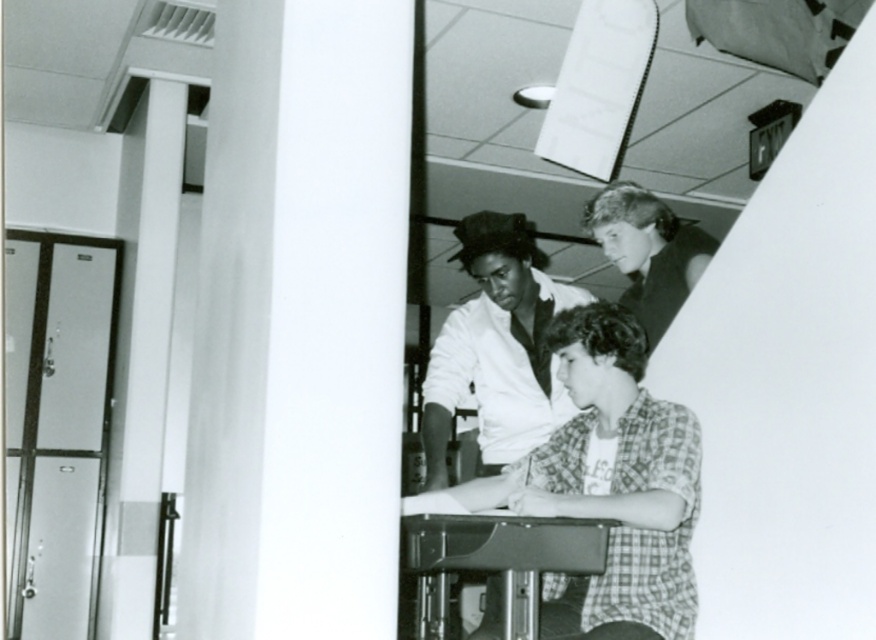
Is smooth white shirt at center wider than metallic gray table at center?

Indeed, smooth white shirt at center has a greater width compared to metallic gray table at center.

Who is taller, smooth white shirt at center or metallic gray table at center?

With more height is smooth white shirt at center.

Which is in front, point (544, 317) or point (447, 531)?

Positioned in front is point (447, 531).

You are a GUI agent. You are given a task and a screenshot of the screen. Output one action in this format:
    pyautogui.click(x=<x>, y=<y>)
    Task: Click on the smooth white shirt at center
    
    Given the screenshot: What is the action you would take?
    pyautogui.click(x=497, y=348)

Is metallic gray table at center smaller than smooth light brown hair at upper right?

Yes.

Measure the distance between metallic gray table at center and camera.

They are 7.06 feet apart.

Who is more forward, (521, 528) or (653, 321)?

Point (521, 528)

The width and height of the screenshot is (876, 640). Identify the location of metallic gray table at center. [x=495, y=561].

Who is higher up, smooth white shirt at center or smooth light brown hair at upper right?

smooth light brown hair at upper right is higher up.

Is point (574, 300) in front of point (655, 259)?

Yes, point (574, 300) is closer to viewer.

I want to click on smooth white shirt at center, so click(x=497, y=348).